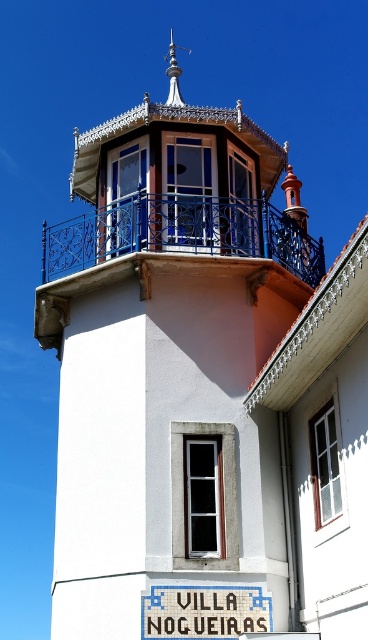
Which is more to the left, blue wrought iron balcony at upper center or white plastic sign at center?

Positioned to the left is blue wrought iron balcony at upper center.

Does blue wrought iron balcony at upper center appear on the right side of white plastic sign at center?

No, blue wrought iron balcony at upper center is not to the right of white plastic sign at center.

Image resolution: width=368 pixels, height=640 pixels. What are the coordinates of `blue wrought iron balcony at upper center` in the screenshot? It's located at (181, 234).

You are a GUI agent. You are given a task and a screenshot of the screen. Output one action in this format:
    pyautogui.click(x=<x>, y=<y>)
    Task: Click on the blue wrought iron balcony at upper center
    
    Given the screenshot: What is the action you would take?
    (x=181, y=234)